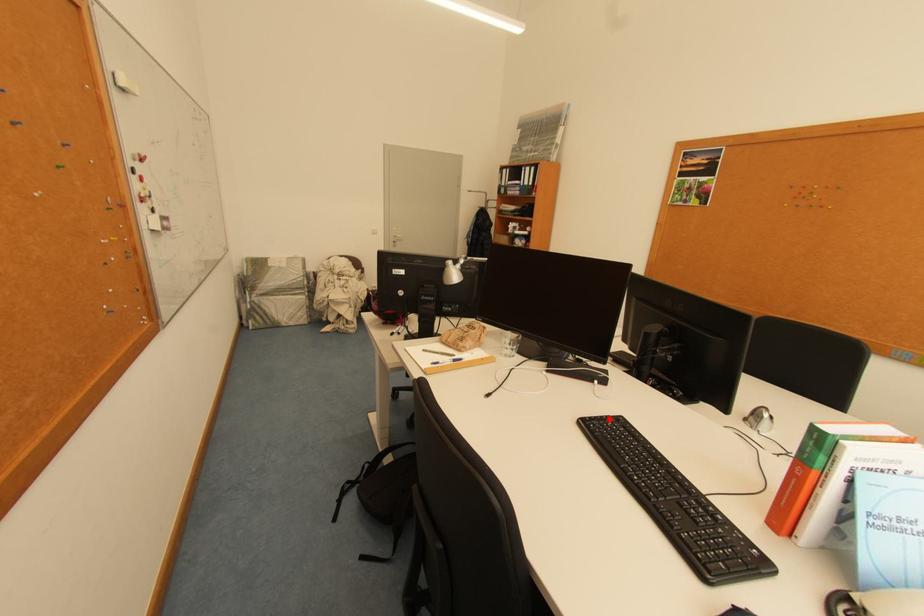
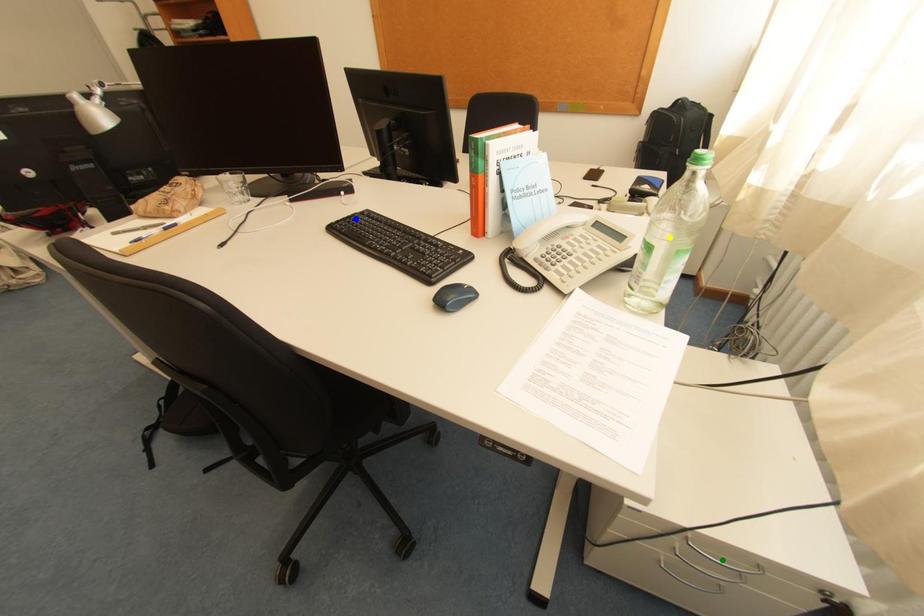
Question: I am providing you with two images of the same scene from different viewpoints. A red point is marked on the first image. You are given multiple points on the second image. Can you choose the point in image 2 that corresponds to the point in image 1?

Choices:
 (A) green point
 (B) blue point
 (C) yellow point

Answer: (B)